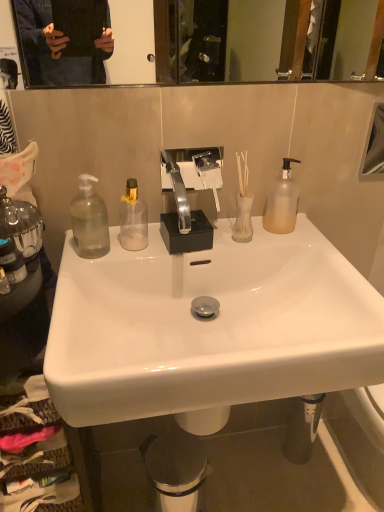
Identify the location of vacant area that lies in front of transparent plastic bottle at left, the 3th bottle positioned from the left. (71, 290).